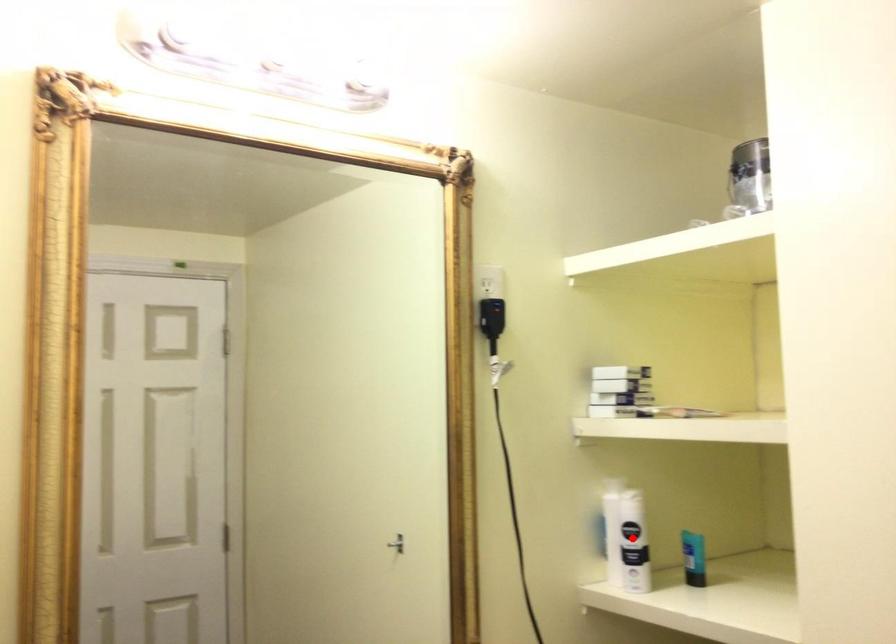
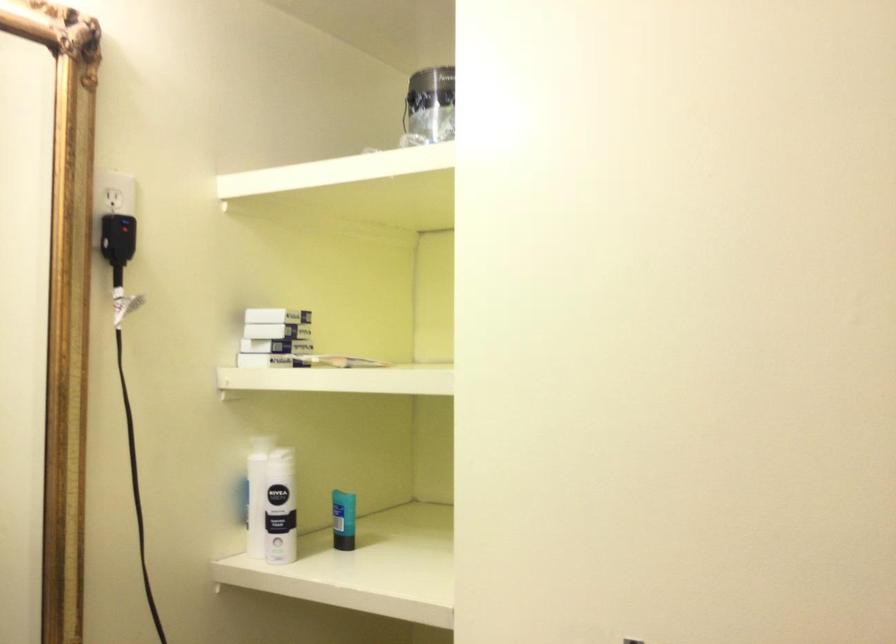
In the second image, find the point that corresponds to the highlighted location in the first image.

(271, 504)